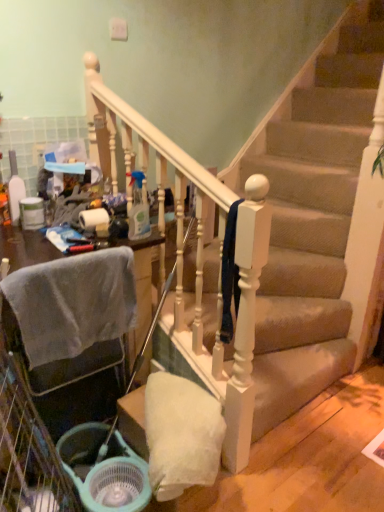
Question: Does carpeted stairs at center appear on the right side of clear plastic spray bottle at center, which ranks as the second bottle in left-to-right order?

Choices:
 (A) no
 (B) yes

Answer: (B)

Question: Would you say carpeted stairs at center is outside clear plastic spray bottle at center, which ranks as the second bottle in left-to-right order?

Choices:
 (A) yes
 (B) no

Answer: (A)

Question: Does carpeted stairs at center lie behind clear plastic spray bottle at center, which ranks as the second bottle in left-to-right order?

Choices:
 (A) yes
 (B) no

Answer: (B)

Question: Is carpeted stairs at center facing towards clear plastic spray bottle at center, the 1th bottle in the right-to-left sequence?

Choices:
 (A) yes
 (B) no

Answer: (A)

Question: From a real-world perspective, is carpeted stairs at center beneath clear plastic spray bottle at center, which ranks as the second bottle in left-to-right order?

Choices:
 (A) no
 (B) yes

Answer: (B)

Question: Is carpeted stairs at center closer to the viewer compared to clear plastic spray bottle at center, the 1th bottle in the right-to-left sequence?

Choices:
 (A) no
 (B) yes

Answer: (B)

Question: Is light blue plastic shopping basket at lower left positioned behind translucent plastic spray bottle at left, the first bottle positioned from the left?

Choices:
 (A) no
 (B) yes

Answer: (A)

Question: Is translucent plastic spray bottle at left, the first bottle positioned from the left, at the back of light blue plastic shopping basket at lower left?

Choices:
 (A) no
 (B) yes

Answer: (A)

Question: Could you tell me if light blue plastic shopping basket at lower left is facing translucent plastic spray bottle at left, the first bottle positioned from the left?

Choices:
 (A) no
 (B) yes

Answer: (A)

Question: Is light blue plastic shopping basket at lower left wider than translucent plastic spray bottle at left, the first bottle positioned from the left?

Choices:
 (A) no
 (B) yes

Answer: (B)

Question: Can you confirm if light blue plastic shopping basket at lower left is taller than translucent plastic spray bottle at left, which is counted as the 2th bottle, starting from the right?

Choices:
 (A) yes
 (B) no

Answer: (B)

Question: Is light blue plastic shopping basket at lower left at the left side of translucent plastic spray bottle at left, the first bottle positioned from the left?

Choices:
 (A) no
 (B) yes

Answer: (A)

Question: Does clear plastic spray bottle at center, which ranks as the second bottle in left-to-right order, lie in front of white glossy toilet paper at upper left?

Choices:
 (A) no
 (B) yes

Answer: (B)